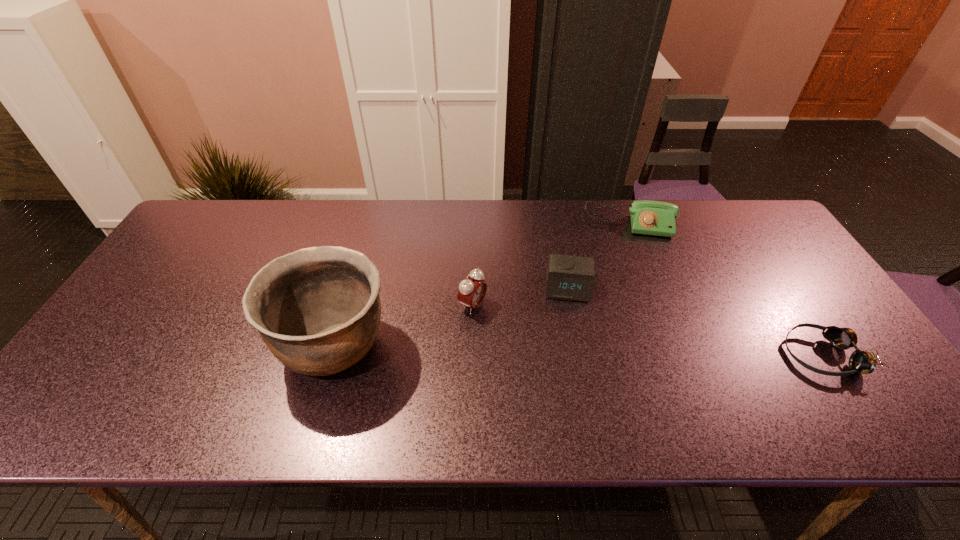
This screenshot has width=960, height=540. In order to click on free area in between the second object from right to left and the third object from right to left in this screenshot , I will do [x=599, y=255].

You are a GUI agent. You are given a task and a screenshot of the screen. Output one action in this format:
    pyautogui.click(x=<x>, y=<y>)
    Task: Click on the vacant region between the shortest object and the second tallest object
    The height and width of the screenshot is (540, 960).
    Given the screenshot: What is the action you would take?
    pyautogui.click(x=647, y=330)

Locate an element on the screen. The height and width of the screenshot is (540, 960). vacant area that lies between the second object from right to left and the goggles is located at coordinates (726, 289).

Locate which object ranks in proximity to the left alarm clock. Please provide its 2D coordinates. Your answer should be formatted as a tuple, i.e. [(x, y)], where the tuple contains the x and y coordinates of a point satisfying the conditions above.

[(317, 309)]

Identify which object is the fourth nearest to the tallest object. Please provide its 2D coordinates. Your answer should be formatted as a tuple, i.e. [(x, y)], where the tuple contains the x and y coordinates of a point satisfying the conditions above.

[(864, 362)]

This screenshot has height=540, width=960. In order to click on vacant area in the image that satisfies the following two spatial constraints: 1. on the back side of the pottery; 2. on the right side of the second object from left to right in this screenshot , I will do `click(347, 305)`.

I want to click on vacant point that satisfies the following two spatial constraints: 1. on the front side of the leftmost object; 2. through the lenses of the rightmost object, so click(x=333, y=355).